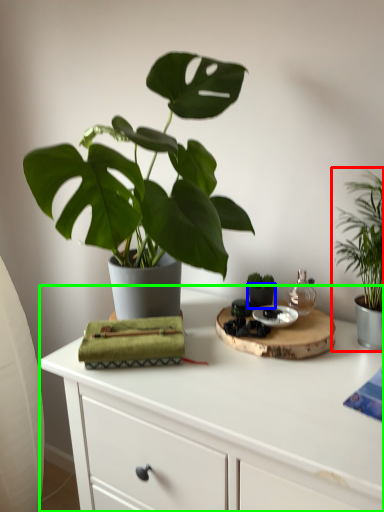
Question: Estimate the real-world distances between objects in this image. Which object is closer to houseplant (highlighted by a red box), flowerpot (highlighted by a blue box) or table (highlighted by a green box)?

Choices:
 (A) flowerpot
 (B) table

Answer: (A)